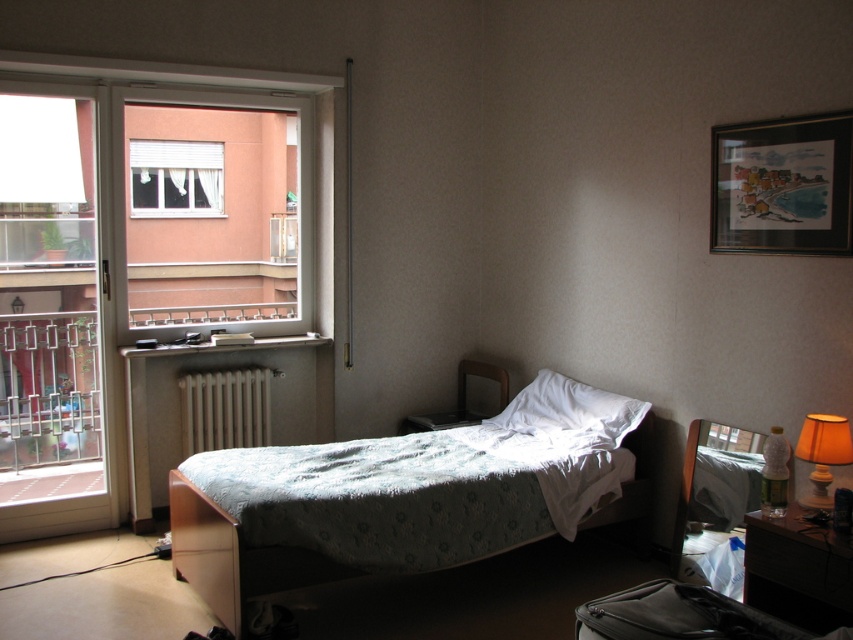
Who is more distant from viewer, (74, 388) or (178, 380)?

Positioned behind is point (74, 388).

Can you confirm if white plastic screen door at left is taller than white wooden radiator at center?

Yes.

The height and width of the screenshot is (640, 853). In order to click on white plastic screen door at left in this screenshot , I will do `click(55, 312)`.

Identify the location of white plastic screen door at left. (55, 312).

Between light blue quilted bed at center and white soft pillow at center, which one appears on the left side from the viewer's perspective?

From the viewer's perspective, light blue quilted bed at center appears more on the left side.

Does point (508, 547) come in front of point (602, 440)?

That is True.

At what (x,y) coordinates should I click in order to perform the action: click on light blue quilted bed at center. Please return your answer as a coordinate pair (x, y). Image resolution: width=853 pixels, height=640 pixels. Looking at the image, I should click on (398, 496).

Can you confirm if matte wooden dresser at lower right is positioned to the right of orange fabric lampshade at right?

In fact, matte wooden dresser at lower right is to the left of orange fabric lampshade at right.

Consider the image. Who is more distant from viewer, (828,625) or (846,452)?

The point (846,452) is more distant.

Which is behind, point (787, 582) or point (827, 497)?

The point (827, 497) is more distant.

I want to click on matte wooden dresser at lower right, so click(798, 570).